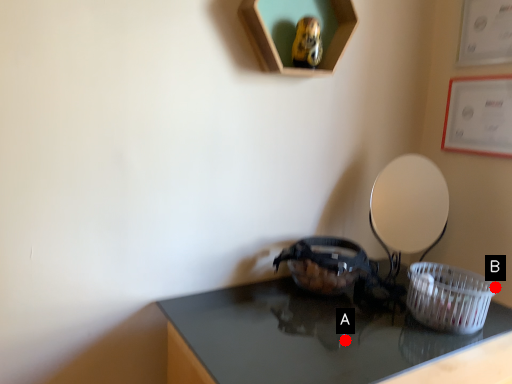
Question: Two points are circled on the image, labeled by A and B beside each circle. Which point is closer to the camera taking this photo?

Choices:
 (A) A is closer
 (B) B is closer

Answer: (A)